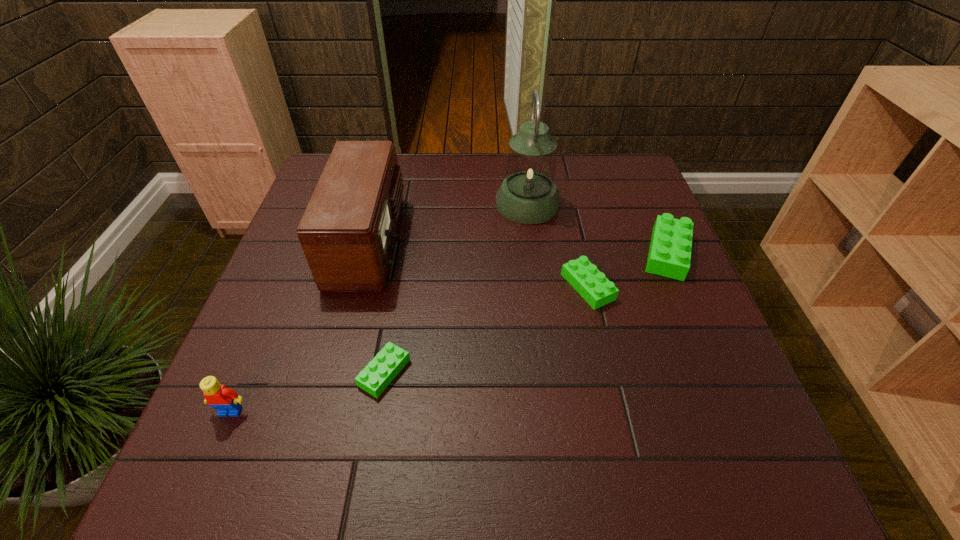
Find the location of a particular element. free spot between the second tallest object and the rightmost object is located at coordinates (518, 247).

The image size is (960, 540). In order to click on vacant area between the fifth farthest object and the fourth shortest object in this screenshot , I will do `click(307, 392)`.

Locate an element on the screen. This screenshot has height=540, width=960. empty space that is in between the third farthest Lego and the lantern is located at coordinates (456, 288).

Find the location of a particular element. The image size is (960, 540). free space between the leftmost object and the third farthest Lego is located at coordinates (307, 392).

Locate an element on the screen. Image resolution: width=960 pixels, height=540 pixels. vacant point located between the fifth shortest object and the tallest Lego is located at coordinates (300, 326).

Find the location of `object that is the closest to the radio receiver`. object that is the closest to the radio receiver is located at coordinates (384, 367).

The image size is (960, 540). Find the location of `object identified as the fifth closest to the shortest object`. object identified as the fifth closest to the shortest object is located at coordinates (669, 255).

You are a GUI agent. You are given a task and a screenshot of the screen. Output one action in this format:
    pyautogui.click(x=<x>, y=<y>)
    Task: Click on the Lego that can be found as the second closest to the shortest object
    
    Given the screenshot: What is the action you would take?
    pyautogui.click(x=583, y=276)

Locate an element on the screen. The height and width of the screenshot is (540, 960). Lego that is the closest to the third tallest Lego is located at coordinates (669, 255).

Locate an element on the screen. free space in the image that satisfies the following two spatial constraints: 1. on the front-facing side of the radio receiver; 2. on the back side of the third shortest Lego is located at coordinates (367, 253).